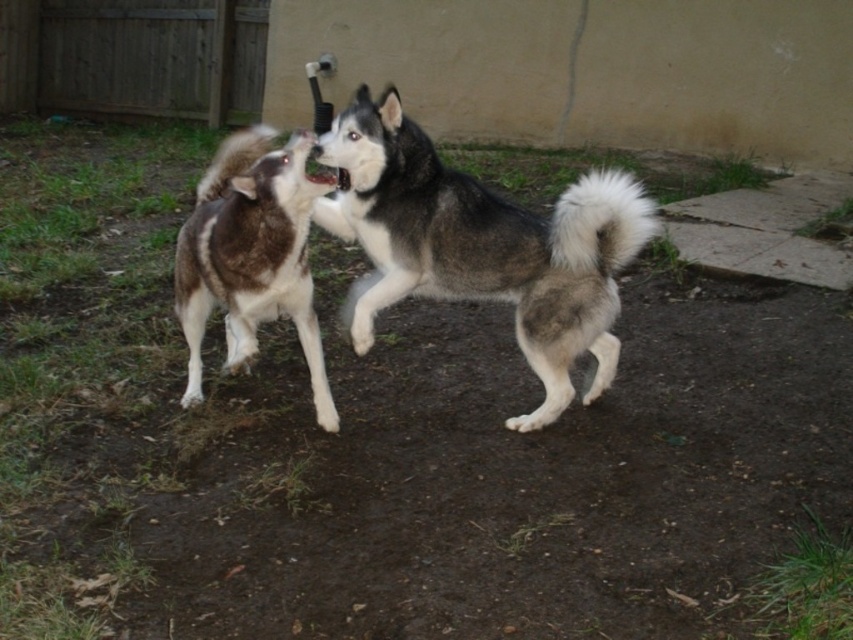
Does point (590, 260) come behind point (194, 289)?

No.

Who is shorter, gray and white fur dog at center or brown fur dog at left?

Standing shorter between the two is brown fur dog at left.

Identify the location of gray and white fur dog at center. The height and width of the screenshot is (640, 853). (480, 244).